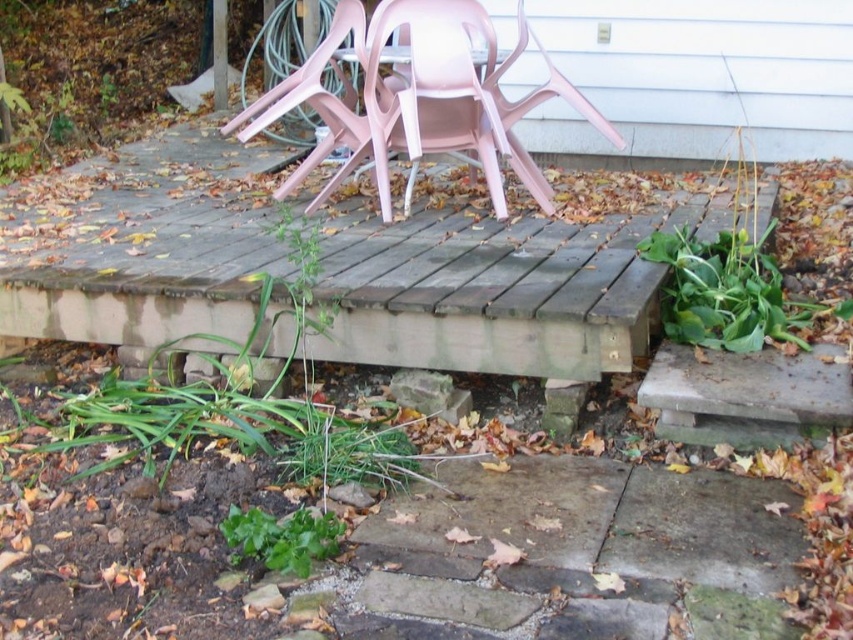
Question: Where is weathered wood deck at center located in relation to pink plastic chairs at upper center in the image?

Choices:
 (A) left
 (B) right

Answer: (A)

Question: Which point appears farthest from the camera in this image?

Choices:
 (A) (149, 241)
 (B) (381, 140)

Answer: (B)

Question: Which object is farther from the camera taking this photo?

Choices:
 (A) pink plastic chairs at upper center
 (B) weathered wood deck at center

Answer: (A)

Question: Considering the relative positions of weathered wood deck at center and pink plastic chairs at upper center in the image provided, where is weathered wood deck at center located with respect to pink plastic chairs at upper center?

Choices:
 (A) above
 (B) below

Answer: (B)

Question: Which point is closer to the camera?

Choices:
 (A) weathered wood deck at center
 (B) pink plastic chairs at upper center

Answer: (A)

Question: Does weathered wood deck at center have a larger size compared to pink plastic chairs at upper center?

Choices:
 (A) yes
 (B) no

Answer: (A)